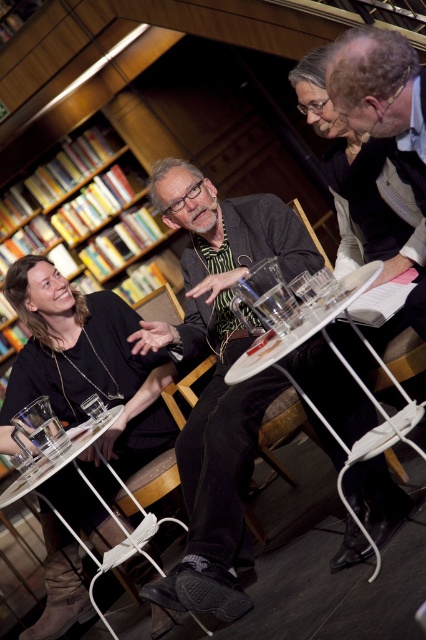
Question: Which is farther from the clear glass table at lower left?

Choices:
 (A) matte black shirt at lower left
 (B) wooden bookcase at upper left
 (C) white plastic table at center
 (D) matte black sweater at center

Answer: (C)

Question: Can you confirm if wooden bookcase at upper left is positioned above clear glass table at lower left?

Choices:
 (A) no
 (B) yes

Answer: (B)

Question: Which is farther from the clear glass table at lower left?

Choices:
 (A) matte black sweater at center
 (B) wooden bookcase at upper left
 (C) white plastic table at center

Answer: (C)

Question: Among these objects, which one is nearest to the camera?

Choices:
 (A) matte black sweater at center
 (B) clear glass table at lower left
 (C) matte black shirt at lower left
 (D) wooden bookcase at upper left

Answer: (A)

Question: Does white plastic table at center appear over clear glass table at lower left?

Choices:
 (A) yes
 (B) no

Answer: (A)

Question: Does matte black sweater at center appear on the right side of matte black shirt at lower left?

Choices:
 (A) yes
 (B) no

Answer: (A)